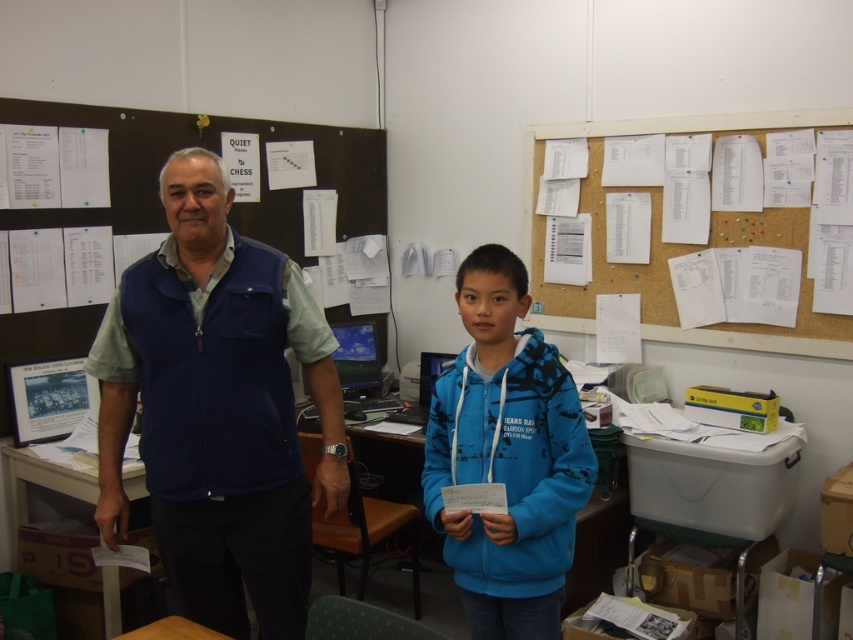
Consider the image. Between blue fleece vest at center and white plastic table at center, which one is positioned higher?

blue fleece vest at center is above.

Which is in front, point (248, 452) or point (595, 538)?

Point (248, 452) is more forward.

The image size is (853, 640). Find the location of `blue fleece vest at center`. blue fleece vest at center is located at coordinates (218, 410).

Between blue fleece vest at center and blue fleece jacket at center, which one is positioned lower?

blue fleece jacket at center is lower down.

Is blue fleece vest at center below blue fleece jacket at center?

Incorrect, blue fleece vest at center is not positioned below blue fleece jacket at center.

Between point (212, 355) and point (508, 336), which one is positioned in front?

Point (508, 336)

The height and width of the screenshot is (640, 853). I want to click on blue fleece vest at center, so click(x=218, y=410).

Which is more to the left, blue fleece jacket at center or white paper at upper right?

Positioned to the left is blue fleece jacket at center.

Is the position of blue fleece jacket at center less distant than that of white paper at upper right?

That is True.

Which is behind, point (490, 365) or point (778, 346)?

Positioned behind is point (778, 346).

This screenshot has height=640, width=853. In order to click on blue fleece jacket at center in this screenshot , I will do `click(508, 456)`.